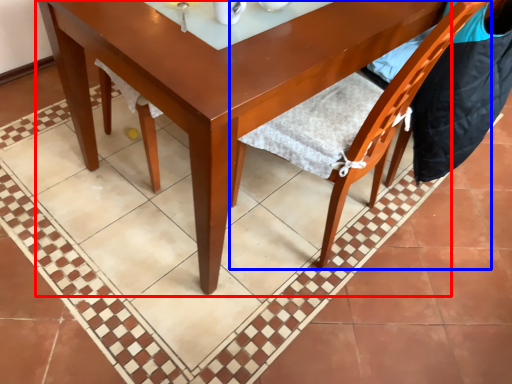
Question: Among these objects, which one is nearest to the camera, round table (highlighted by a red box) or chair (highlighted by a blue box)?

Choices:
 (A) round table
 (B) chair

Answer: (B)